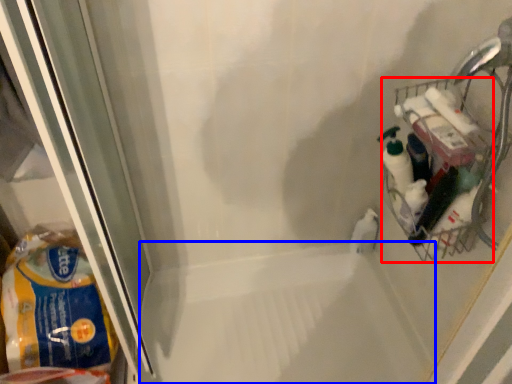
Question: Which object is closer to the camera taking this photo, basket (highlighted by a red box) or bath (highlighted by a blue box)?

Choices:
 (A) basket
 (B) bath

Answer: (A)